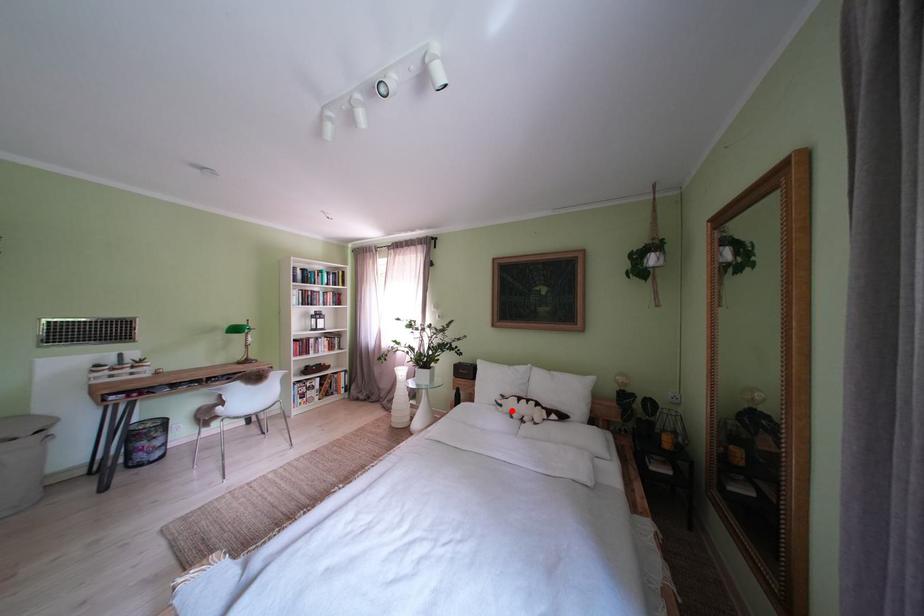
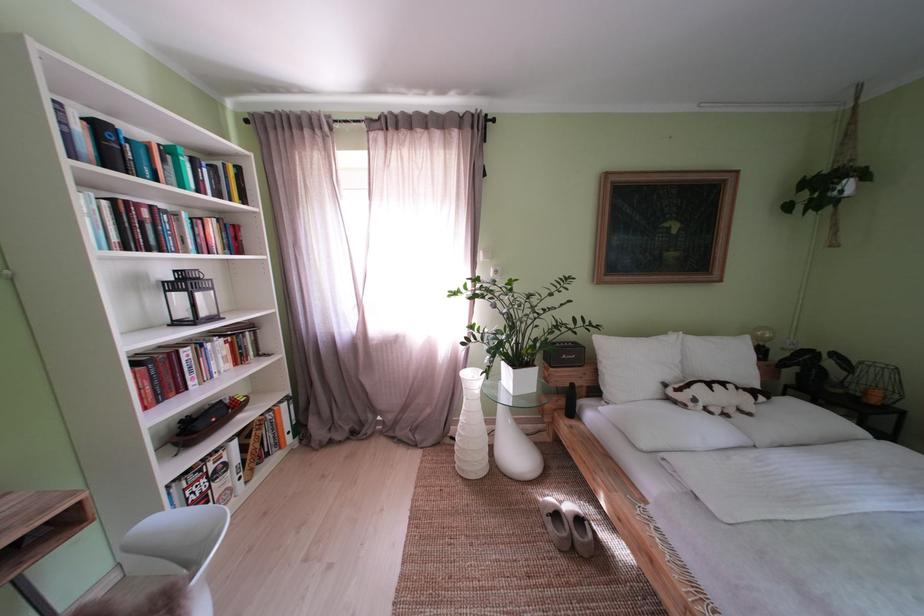
Where in the second image is the point corresponding to the highlighted location from the first image?

(706, 406)